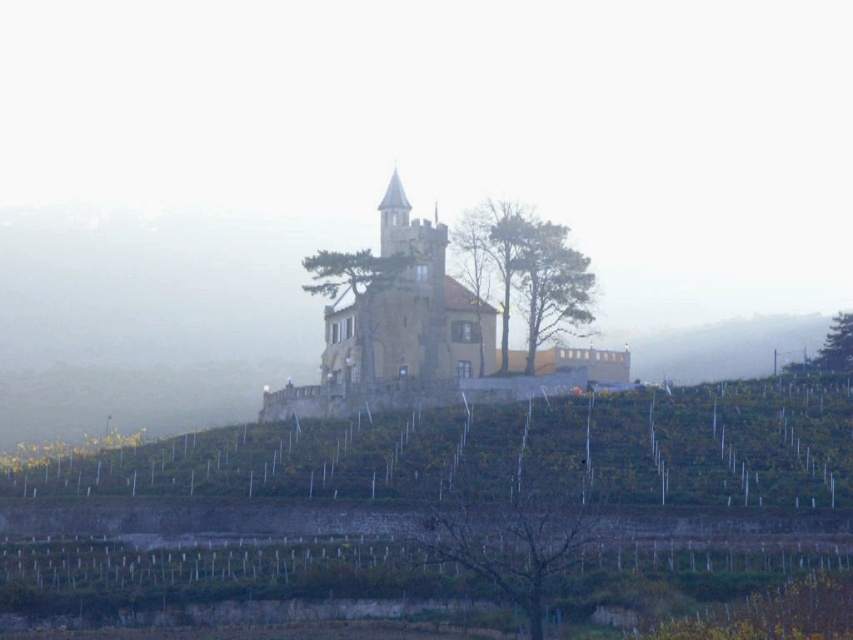
Is brown textured tree at center smaller than green leafy tree at upper right?

Yes, brown textured tree at center is smaller than green leafy tree at upper right.

Does brown textured tree at center have a lesser width compared to green leafy tree at upper right?

Indeed, brown textured tree at center has a lesser width compared to green leafy tree at upper right.

This screenshot has height=640, width=853. What do you see at coordinates (509, 540) in the screenshot? I see `brown textured tree at center` at bounding box center [509, 540].

Where is `brown textured tree at center`? The height and width of the screenshot is (640, 853). brown textured tree at center is located at coordinates (509, 540).

Measure the distance between yellow stone church at center and green textured tree at center.

A distance of 19.76 feet exists between yellow stone church at center and green textured tree at center.

Between yellow stone church at center and green textured tree at center, which one appears on the right side from the viewer's perspective?

From the viewer's perspective, green textured tree at center appears more on the right side.

Is point (438, 310) behind point (483, 224)?

No, it is not.

I want to click on yellow stone church at center, so pyautogui.click(x=408, y=310).

Is point (448, 289) positioned behind point (532, 528)?

Yes, point (448, 289) is farther from viewer.

Is brown stone church at center further to the viewer compared to brown textured tree at center?

Yes, brown stone church at center is behind brown textured tree at center.

Describe the element at coordinates (422, 339) in the screenshot. I see `brown stone church at center` at that location.

Find the location of a particular element. The width and height of the screenshot is (853, 640). brown stone church at center is located at coordinates (422, 339).